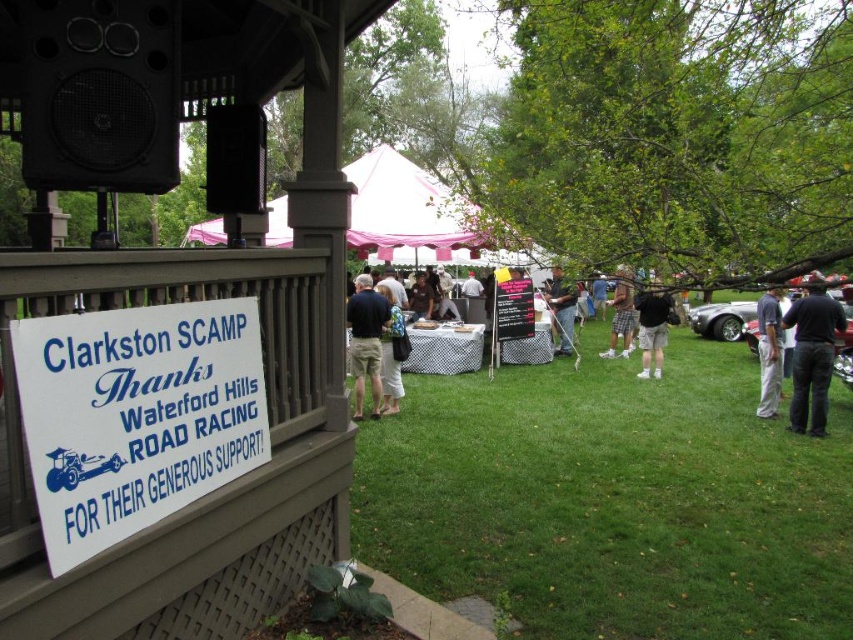
Question: Is the position of white wood sign at lower left more distant than that of camouflage shorts at center?

Choices:
 (A) no
 (B) yes

Answer: (A)

Question: Which of the following is the closest to the observer?

Choices:
 (A) (296, 458)
 (B) (770, 378)
 (C) (625, 276)

Answer: (A)

Question: Does gray cotton pants at right have a lesser width compared to blue denim shorts at center?

Choices:
 (A) yes
 (B) no

Answer: (A)

Question: Which point is farther from the camera taking this photo?

Choices:
 (A) (184, 609)
 (B) (496, 424)
 (C) (369, 330)

Answer: (C)

Question: Is green grass at center further to the viewer compared to gray cotton pants at right?

Choices:
 (A) yes
 (B) no

Answer: (B)

Question: Estimate the real-world distances between objects in this image. Which object is closer to the gray cotton pants at right?

Choices:
 (A) white wood sign at lower left
 (B) green grass at center
 (C) dark blue jeans at center

Answer: (C)